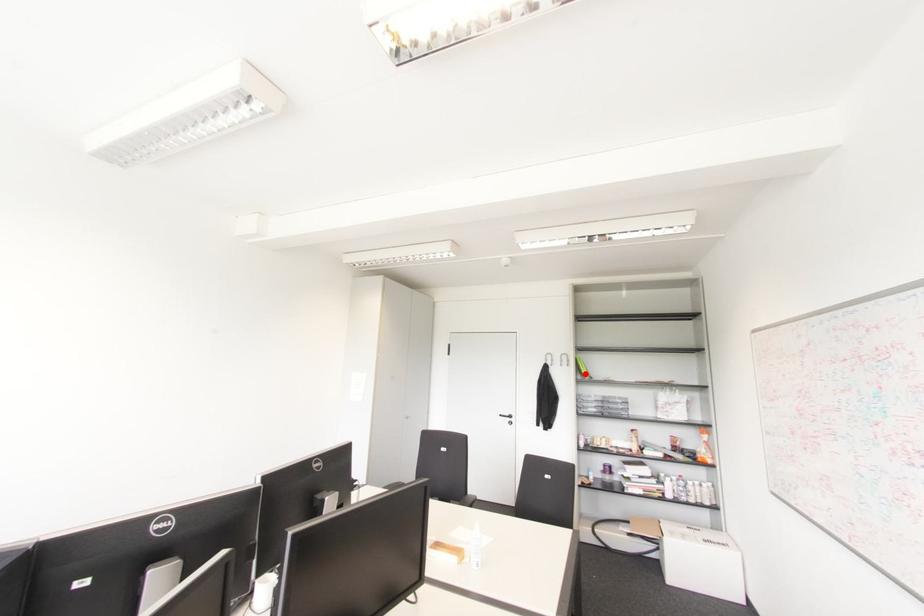
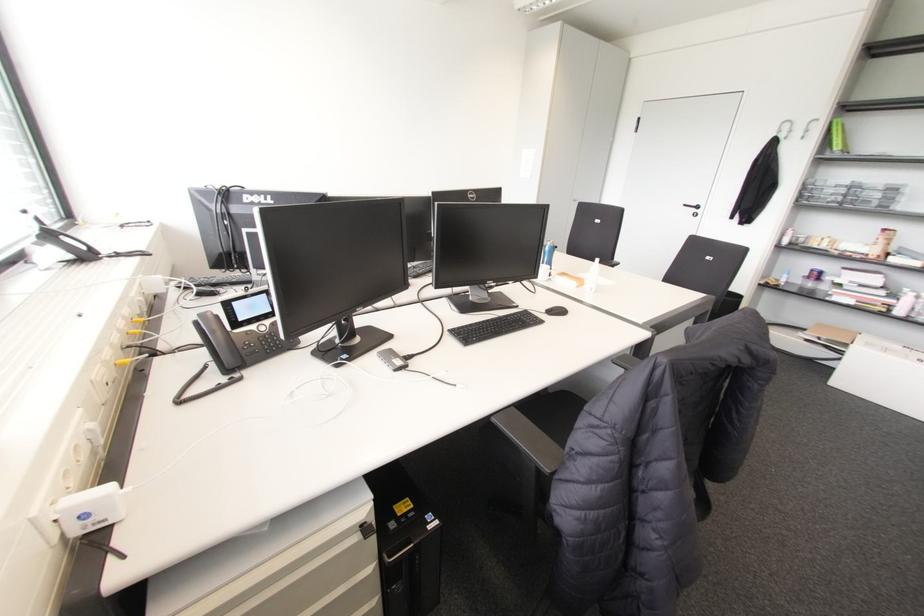
In the second image, find the point that corresponds to the highlighted location in the first image.

(836, 147)